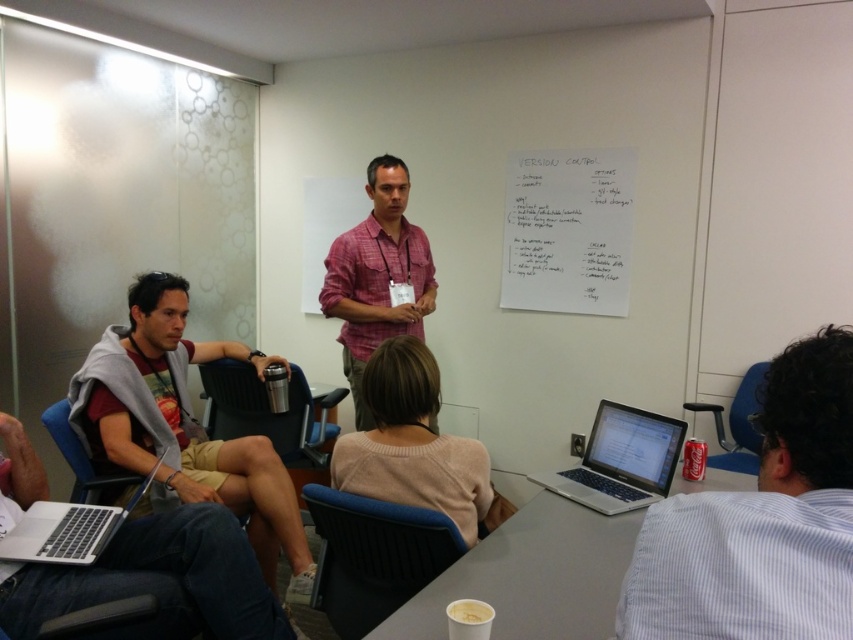
Does silver metallic laptop at lower center have a greater height compared to metallic/black chair at lower left?

Incorrect, silver metallic laptop at lower center's height is not larger of metallic/black chair at lower left's.

Does silver metallic laptop at lower center have a smaller size compared to metallic/black chair at lower left?

Correct, silver metallic laptop at lower center occupies less space than metallic/black chair at lower left.

You are a GUI agent. You are given a task and a screenshot of the screen. Output one action in this format:
    pyautogui.click(x=<x>, y=<y>)
    Task: Click on the silver metallic laptop at lower center
    The image size is (853, 640).
    Given the screenshot: What is the action you would take?
    pyautogui.click(x=621, y=460)

Between blue fabric chair at center and silver metallic laptop at lower left, which one is positioned lower?

Positioned lower is blue fabric chair at center.

Is blue fabric chair at center bigger than silver metallic laptop at lower left?

Yes.

Is point (331, 524) less distant than point (88, 547)?

That is False.

The height and width of the screenshot is (640, 853). In order to click on blue fabric chair at center in this screenshot , I will do `click(373, 556)`.

Does metallic/black chair at lower left have a greater width compared to blue plastic chair at lower right?

Correct, the width of metallic/black chair at lower left exceeds that of blue plastic chair at lower right.

Can you confirm if metallic/black chair at lower left is positioned to the left of blue plastic chair at lower right?

Correct, you'll find metallic/black chair at lower left to the left of blue plastic chair at lower right.

The image size is (853, 640). I want to click on metallic/black chair at lower left, so click(271, 417).